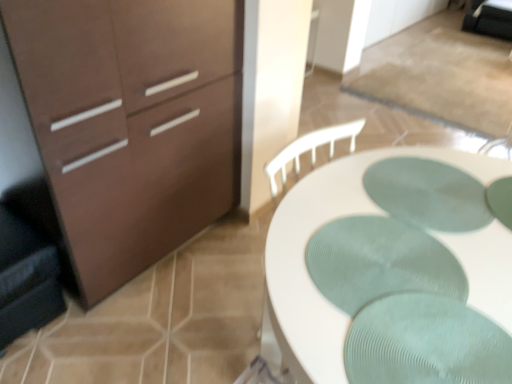
Question: Does white textured desk at center have a smaller size compared to dark gray fabric swivel chair at left?

Choices:
 (A) yes
 (B) no

Answer: (B)

Question: Can you confirm if white textured desk at center is shorter than dark gray fabric swivel chair at left?

Choices:
 (A) yes
 (B) no

Answer: (B)

Question: Is white textured desk at center thinner than dark gray fabric swivel chair at left?

Choices:
 (A) yes
 (B) no

Answer: (B)

Question: From the image's perspective, would you say white textured desk at center is positioned over dark gray fabric swivel chair at left?

Choices:
 (A) yes
 (B) no

Answer: (A)

Question: From a real-world perspective, is white textured desk at center on top of dark gray fabric swivel chair at left?

Choices:
 (A) yes
 (B) no

Answer: (A)

Question: Does white textured desk at center turn towards dark gray fabric swivel chair at left?

Choices:
 (A) no
 (B) yes

Answer: (A)

Question: Are matte brown cabinet at left and dark gray fabric swivel chair at left making contact?

Choices:
 (A) no
 (B) yes

Answer: (A)

Question: Could you tell me if matte brown cabinet at left is facing dark gray fabric swivel chair at left?

Choices:
 (A) no
 (B) yes

Answer: (A)

Question: Considering the relative sizes of matte brown cabinet at left and dark gray fabric swivel chair at left in the image provided, is matte brown cabinet at left wider than dark gray fabric swivel chair at left?

Choices:
 (A) no
 (B) yes

Answer: (B)

Question: Can you confirm if matte brown cabinet at left is thinner than dark gray fabric swivel chair at left?

Choices:
 (A) yes
 (B) no

Answer: (B)

Question: Is dark gray fabric swivel chair at left a part of matte brown cabinet at left?

Choices:
 (A) yes
 (B) no

Answer: (B)

Question: From a real-world perspective, is matte brown cabinet at left beneath dark gray fabric swivel chair at left?

Choices:
 (A) no
 (B) yes

Answer: (A)

Question: Does white textured desk at center have a greater height compared to green ribbed placemat at center, arranged as the 1th oval when viewed from the front?

Choices:
 (A) yes
 (B) no

Answer: (A)